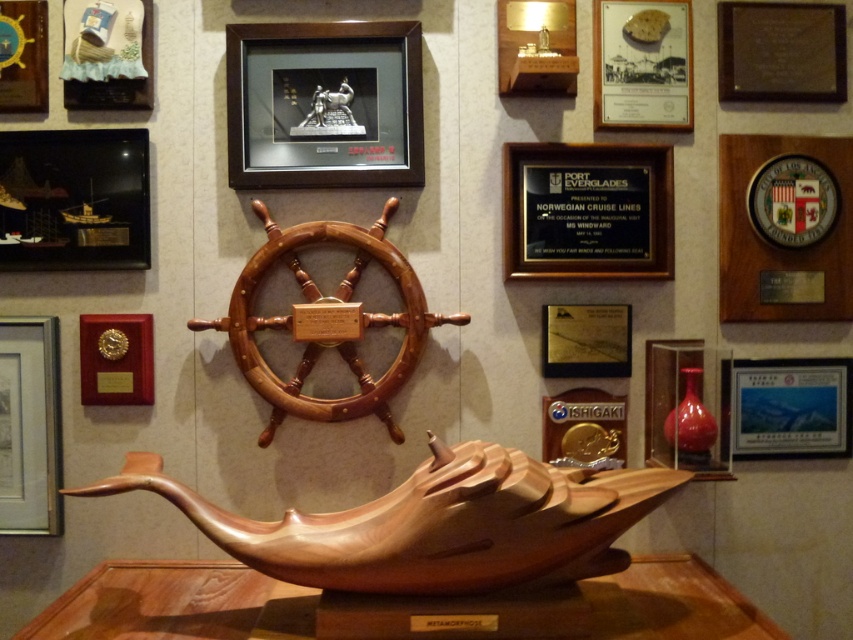
Question: Which object appears farthest from the camera in this image?

Choices:
 (A) wooden frame at upper center
 (B) matte black ship at upper left
 (C) brushed metal picture frame at upper left

Answer: (C)

Question: Which object appears farthest from the camera in this image?

Choices:
 (A) wooden boat at lower center
 (B) matte wooden picture frame at right

Answer: (B)

Question: Can you confirm if wooden frame at upper center is positioned to the right of matte black ship at upper left?

Choices:
 (A) no
 (B) yes

Answer: (B)

Question: Does wooden plaque at upper right appear on the right side of brushed metal picture frame at upper left?

Choices:
 (A) yes
 (B) no

Answer: (A)

Question: Can you confirm if matte silver picture frame at upper right is bigger than brushed metal picture frame at upper left?

Choices:
 (A) yes
 (B) no

Answer: (A)

Question: Which object is the closest to the wooden ship at upper left?

Choices:
 (A) wooden table at lower center
 (B) wooden polished at center
 (C) wooden plaque at upper center
 (D) matte red vase at right

Answer: (B)